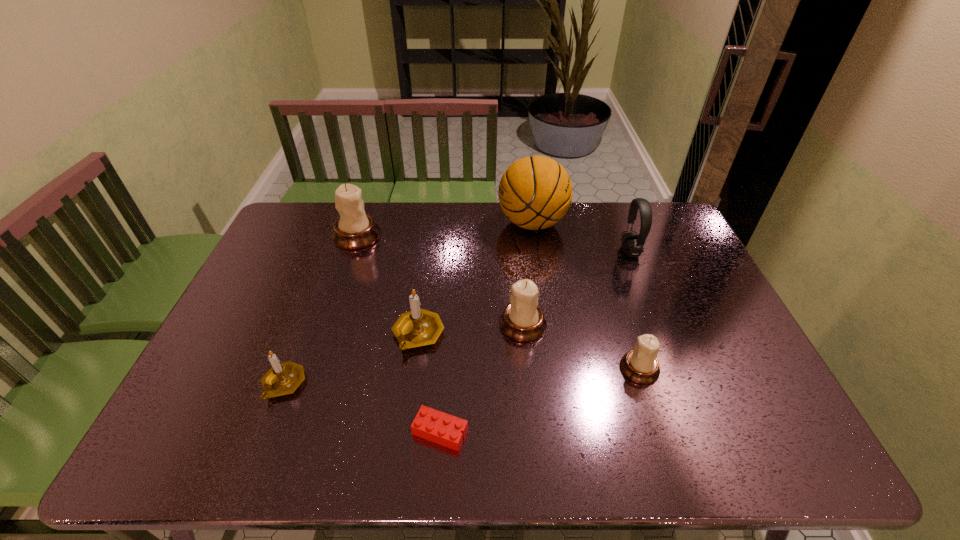
Locate an element on the screen. This screenshot has height=540, width=960. the rightmost candle holder is located at coordinates (640, 365).

Where is `the left gold candle holder`? the left gold candle holder is located at coordinates (284, 378).

The width and height of the screenshot is (960, 540). Find the location of `the nearer gold candle holder`. the nearer gold candle holder is located at coordinates (284, 378).

Find the location of a particular element. the nearest object is located at coordinates (430, 424).

Locate an element on the screen. Image resolution: width=960 pixels, height=540 pixels. the shortest object is located at coordinates (430, 424).

Identify the location of vacant space located on the surface of the basketball near the brand logo. (423, 223).

Locate an element on the screen. vacant space located 0.400m on the surface of the basketball near the brand logo is located at coordinates (388, 223).

The image size is (960, 540). In order to click on vacant space located on the surface of the basketball near the brand logo in this screenshot , I will do [x=388, y=223].

In order to click on vacant space situated 0.100m on the right of the biggest white candle holder in this screenshot , I will do `click(409, 235)`.

You are a GUI agent. You are given a task and a screenshot of the screen. Output one action in this format:
    pyautogui.click(x=<x>, y=<y>)
    Task: Click on the vacant space located 0.090m on the front-facing side of the headset
    The width and height of the screenshot is (960, 540).
    Given the screenshot: What is the action you would take?
    pyautogui.click(x=594, y=252)